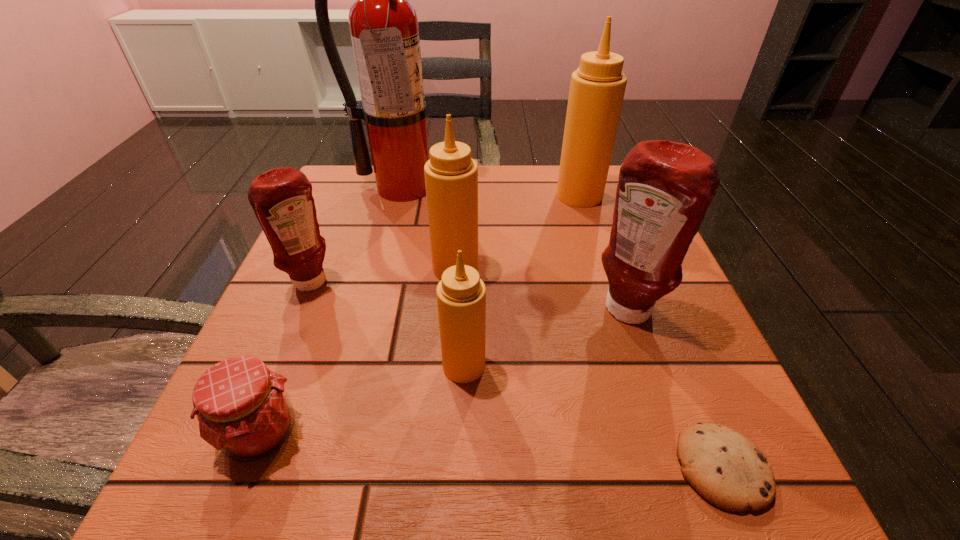
Identify the location of vacant space located 0.120m on the back of the cookie. (676, 356).

Locate an element on the screen. fire extinguisher located in the far edge section of the desktop is located at coordinates (383, 24).

Where is `condiment positioned at the far edge`? Image resolution: width=960 pixels, height=540 pixels. condiment positioned at the far edge is located at coordinates tap(597, 88).

Where is `jam present at the near edge`? The image size is (960, 540). jam present at the near edge is located at coordinates (243, 409).

Identify the location of cookie that is positioned at the near edge. (727, 469).

This screenshot has width=960, height=540. Identify the location of fire extinguisher located in the left edge section of the desktop. (383, 24).

Locate an element on the screen. condiment present at the left edge is located at coordinates (281, 198).

Find the location of a particular element. This screenshot has height=540, width=960. jam present at the left edge is located at coordinates (243, 409).

Identify the location of cookie positioned at the right edge. The height and width of the screenshot is (540, 960). (727, 469).

Locate an element on the screen. This screenshot has width=960, height=540. object that is at the far left corner is located at coordinates (383, 24).